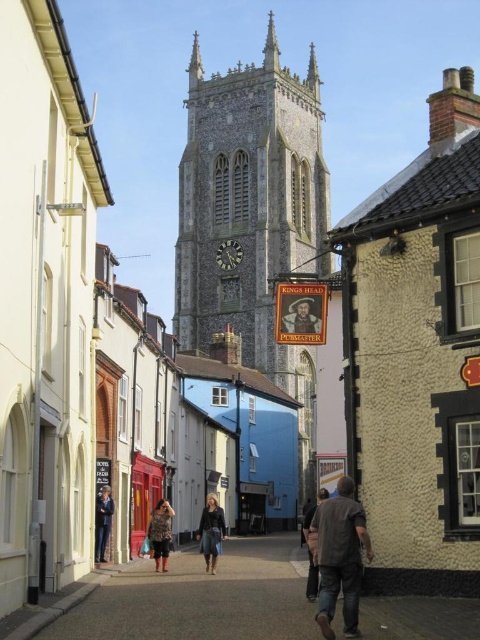
Question: Which of the following is the closest to the observer?

Choices:
 (A) smooth stone clock tower at center
 (B) leather jacket at center
 (C) brown cotton shirt at center

Answer: (C)

Question: Does brown cotton shirt at center appear on the right side of dark brown leather jacket at center?

Choices:
 (A) no
 (B) yes

Answer: (B)

Question: Considering the real-world distances, which object is farthest from the brown cotton shirt at center?

Choices:
 (A) dark blue jeans at center
 (B) smooth stone clock tower at center
 (C) dark brown leather jacket at center
 (D) smooth concrete pavement at center

Answer: (B)

Question: Does brown cotton shirt at center appear on the left side of dark blue suit at center?

Choices:
 (A) no
 (B) yes

Answer: (A)

Question: Does smooth stone clock tower at center lie in front of wooden signboard at center?

Choices:
 (A) yes
 (B) no

Answer: (B)

Question: Which object is the closest to the dark brown leather jacket at center?

Choices:
 (A) wooden signboard at center
 (B) brown cotton shirt at center
 (C) leather jacket at center
 (D) dark blue suit at center

Answer: (B)